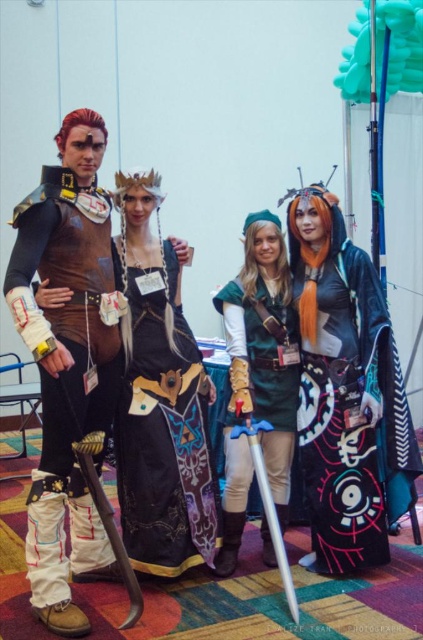
Who is positioned more to the right, black satin dress at center or silver metallic sword at center?

silver metallic sword at center

Does point (206, 381) come behind point (277, 550)?

Yes.

Identify the location of black satin dress at center. (164, 435).

Is brown leather vest at left smaller than gold metallic sword at lower left?

No.

Is brown leather vest at left below gold metallic sword at lower left?

Incorrect, brown leather vest at left is not positioned below gold metallic sword at lower left.

Describe the element at coordinates (69, 285) in the screenshot. This screenshot has width=423, height=640. I see `brown leather vest at left` at that location.

This screenshot has height=640, width=423. Identify the location of brown leather vest at left. (69, 285).

Is velvet black cape at center above gold metallic sword at lower left?

Yes.

What do you see at coordinates (346, 392) in the screenshot?
I see `velvet black cape at center` at bounding box center [346, 392].

Between point (360, 449) and point (87, 442), which one is positioned in front?

Point (87, 442)

Locate an element on the screen. velvet black cape at center is located at coordinates (346, 392).